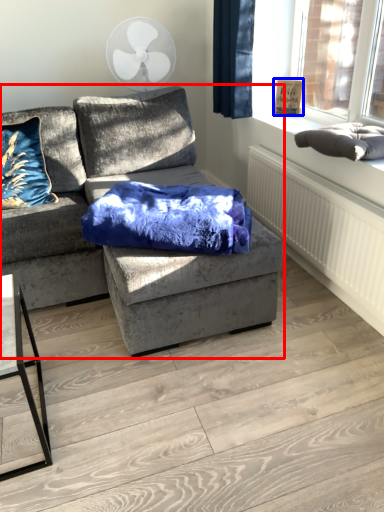
Question: Which point is closer to the camera, studio couch (highlighted by a red box) or picture frame (highlighted by a blue box)?

Choices:
 (A) studio couch
 (B) picture frame

Answer: (A)